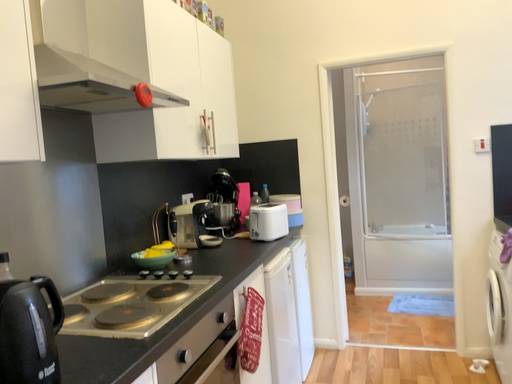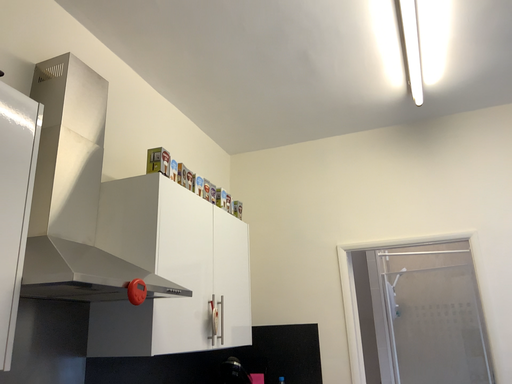
Question: How did the camera likely rotate when shooting the video?

Choices:
 (A) rotated upward
 (B) rotated downward

Answer: (A)